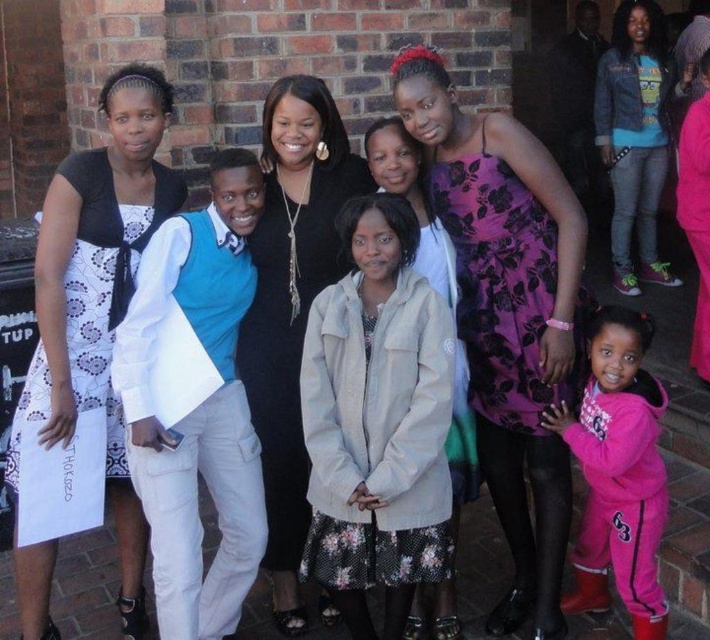
You are standing in front of the group and want to find the purple floral dress at center. Based on the scene description, where would you look relative to the other people in the group?

The purple floral dress at center is located at point (507, 316), which is near the center of the image. Since the group is standing closely together, you should look towards the middle of the group to find the purple floral dress at center.

You are a photographer trying to adjust the composition of the group photo. You notice the purple floral dress at center and the pink fleece jacket at lower right. Which object is positioned further away from the camera?

The pink fleece jacket at lower right is behind the purple floral dress at center, so it is further away from the camera.

You are a photographer trying to adjust the lighting for a group photo. You notice the purple floral dress at center and the matte black dress at center. Which dress might need more lighting adjustments to ensure it stands out in the photo?

The matte black dress at center might need more lighting adjustments to ensure it stands out in the photo because it is positioned behind the purple floral dress at center, which could cast shadows or reduce its visibility.